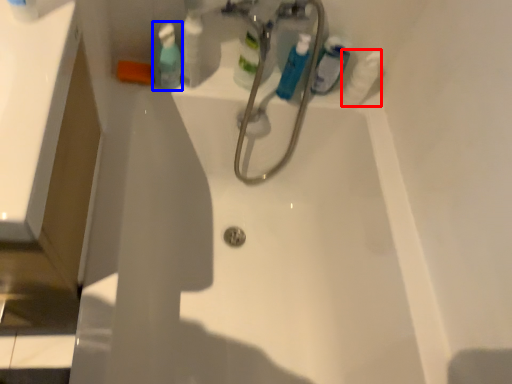
Question: Which of the following is the closest to the observer, cleaning product (highlighted by a red box) or mouthwash (highlighted by a blue box)?

Choices:
 (A) cleaning product
 (B) mouthwash

Answer: (B)